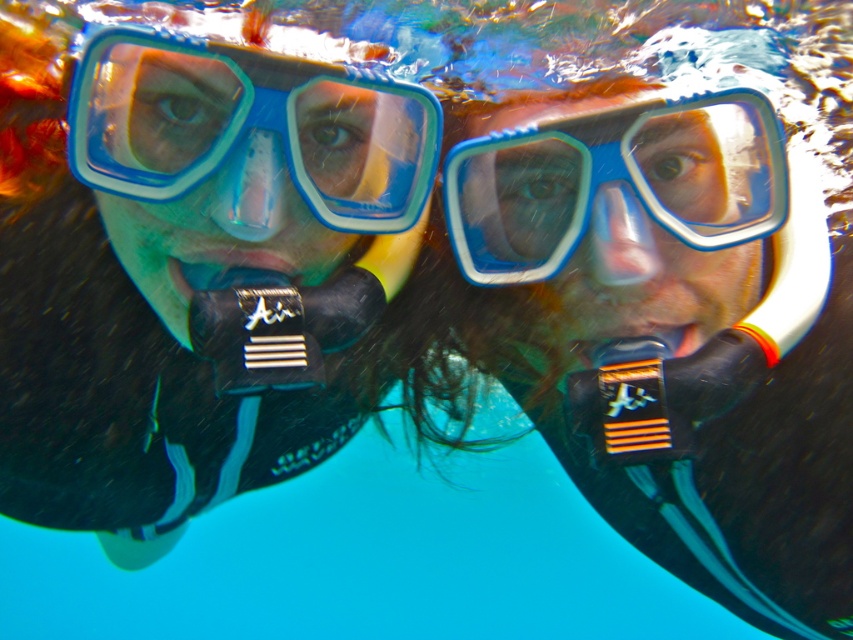
Question: Which of the following is the closest to the observer?

Choices:
 (A) blue rubber goggles at center
 (B) blue plastic goggles at center

Answer: (B)

Question: Which point is closer to the camera?

Choices:
 (A) (550, 122)
 (B) (405, 193)

Answer: (A)

Question: Where is blue plastic goggles at center located in relation to blue rubber goggles at center in the image?

Choices:
 (A) above
 (B) below

Answer: (A)

Question: Can you confirm if blue plastic goggles at center is positioned above blue rubber goggles at center?

Choices:
 (A) yes
 (B) no

Answer: (A)

Question: Which point is farther from the camera taking this photo?

Choices:
 (A) (112, 67)
 (B) (444, 182)

Answer: (B)

Question: Observing the image, what is the correct spatial positioning of blue plastic goggles at center in reference to blue rubber goggles at center?

Choices:
 (A) left
 (B) right

Answer: (A)